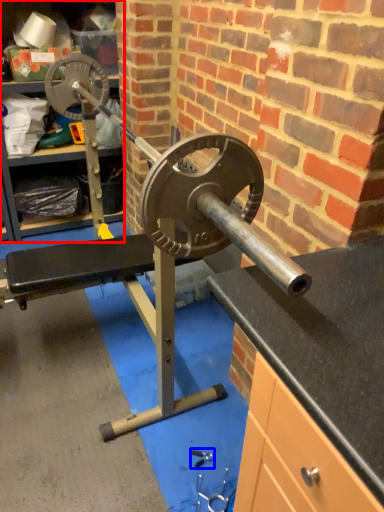
Question: Which object appears farthest to the camera in this image, cabinet (highlighted by a red box) or tool (highlighted by a blue box)?

Choices:
 (A) cabinet
 (B) tool

Answer: (A)